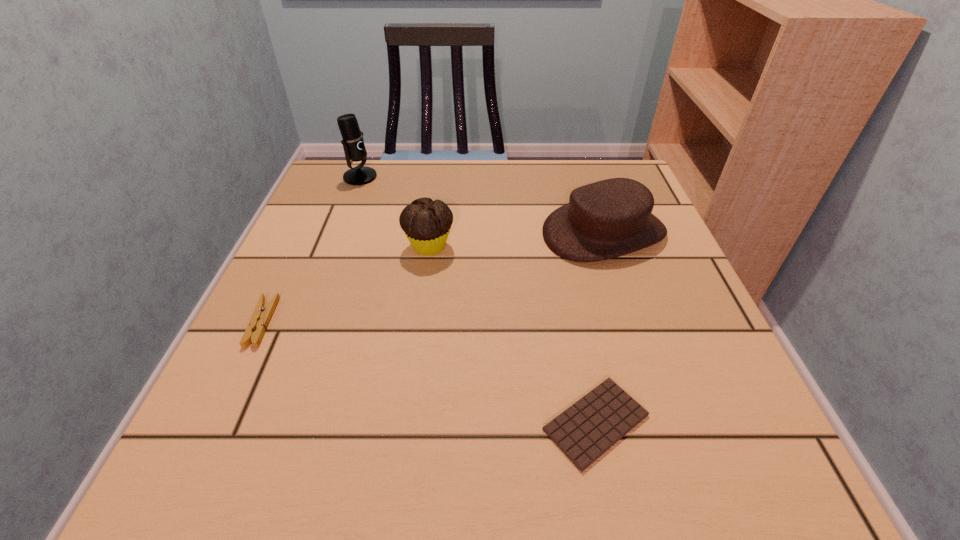
This screenshot has height=540, width=960. In order to click on object located at the far left corner in this screenshot , I will do `click(353, 143)`.

At what (x,y) coordinates should I click in order to perform the action: click on object that is at the far right corner. Please return your answer as a coordinate pair (x, y). This screenshot has height=540, width=960. Looking at the image, I should click on (610, 218).

Where is `object that is at the near right corner`? Image resolution: width=960 pixels, height=540 pixels. object that is at the near right corner is located at coordinates (586, 430).

Locate an element on the screen. free region at the far edge of the desktop is located at coordinates (568, 179).

I want to click on vacant space at the left edge of the desktop, so click(x=342, y=217).

Where is `blank space at the right edge of the desktop`? The image size is (960, 540). blank space at the right edge of the desktop is located at coordinates (646, 279).

Locate an element on the screen. free space at the far left corner of the desktop is located at coordinates (335, 210).

At what (x,y) coordinates should I click in order to perform the action: click on vacant space at the near left corner of the desktop. Please return your answer as a coordinate pair (x, y). Looking at the image, I should click on (302, 479).

Identify the location of free space at the far right corner of the desktop. The width and height of the screenshot is (960, 540). (580, 166).

You are a GUI agent. You are given a task and a screenshot of the screen. Output one action in this format:
    pyautogui.click(x=<x>, y=<y>)
    Task: Click on the free space at the near right corner
    The image size is (960, 540).
    Given the screenshot: What is the action you would take?
    pyautogui.click(x=751, y=467)